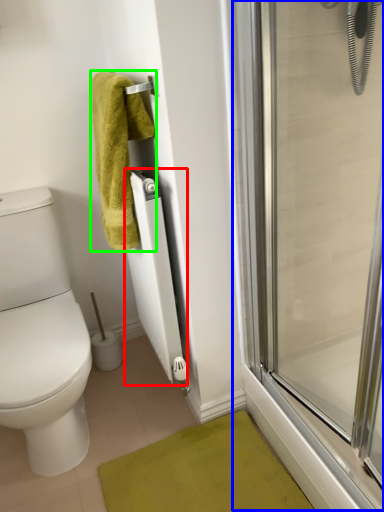
Question: Which is nearer to the radiator (highlighted by a red box)? screen door (highlighted by a blue box) or towel (highlighted by a green box).

Choices:
 (A) screen door
 (B) towel

Answer: (B)